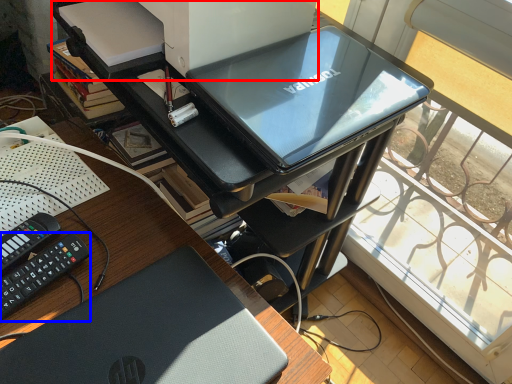
Question: Which of the following is the closest to the observer, printer (highlighted by a red box) or equipment (highlighted by a blue box)?

Choices:
 (A) printer
 (B) equipment

Answer: (B)